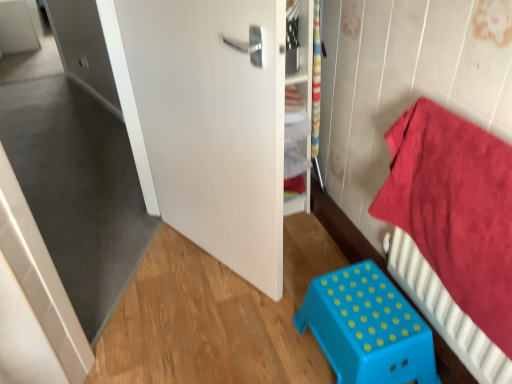
Question: Is white matte door at center taller or shorter than blue plastic stool at lower center?

Choices:
 (A) tall
 (B) short

Answer: (A)

Question: From the image's perspective, relative to blue plastic stool at lower center, is white matte door at center above or below?

Choices:
 (A) below
 (B) above

Answer: (B)

Question: Estimate the real-world distances between objects in this image. Which object is farther from the red cotton towel at right?

Choices:
 (A) white matte door at center
 (B) blue plastic stool at lower center

Answer: (A)

Question: Estimate the real-world distances between objects in this image. Which object is farther from the blue plastic stool at lower center?

Choices:
 (A) white matte door at center
 (B) red cotton towel at right

Answer: (A)